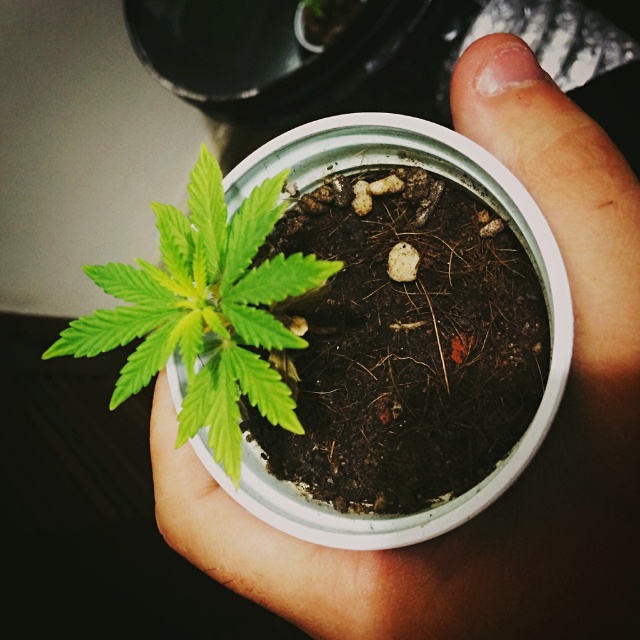
You are a delivery person who needs to place a package on the surface near the point marked at coordinates (525, 467). Is the surface at that point suitable for placing a heavy package?

The point marked at coordinates (525, 467) is on smooth skin hand at center, which is not a stable surface for placing a heavy package. Please choose a different surface like the metallic surface in the background.

You are a gardener who needs to water the green matte leafy plant at center without getting water on the smooth skin hand at center. Which side should you aim the watering can towards?

The smooth skin hand at center is on the right side of the green matte leafy plant at center, so you should aim the watering can towards the left side of the plant to avoid getting water on the hand.

Based on the scene description, where is the smooth skin hand at center located in the image? Please provide the coordinates in the format of a point like this example format for reference only, not part of the answer. The answer should be in the form of a point like this example format for reference only, not part of the answer. The answer should be in the form of a point like this example format for reference only, not part of the answer. The answer should be in the form of a point like this example. The

The smooth skin hand at center is located at point (525, 467).